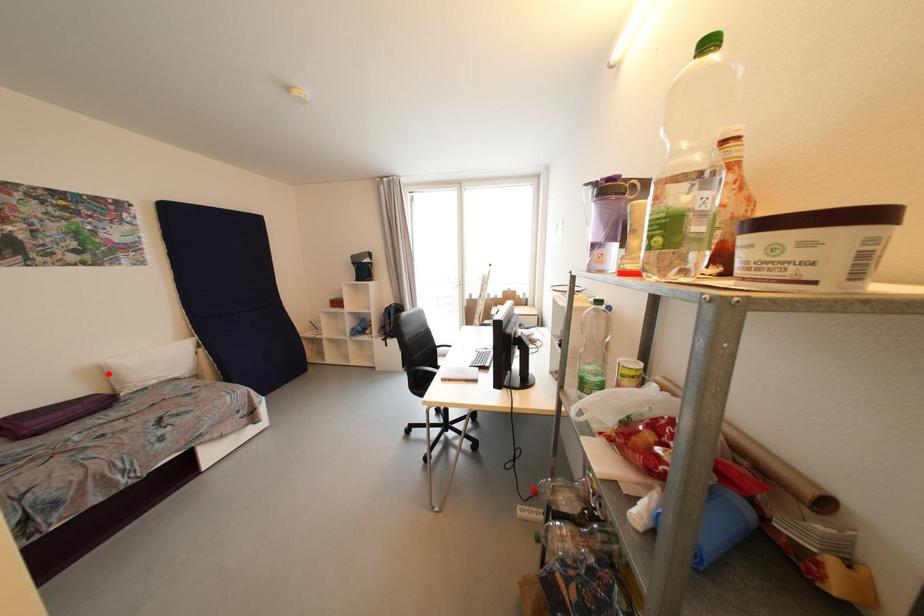
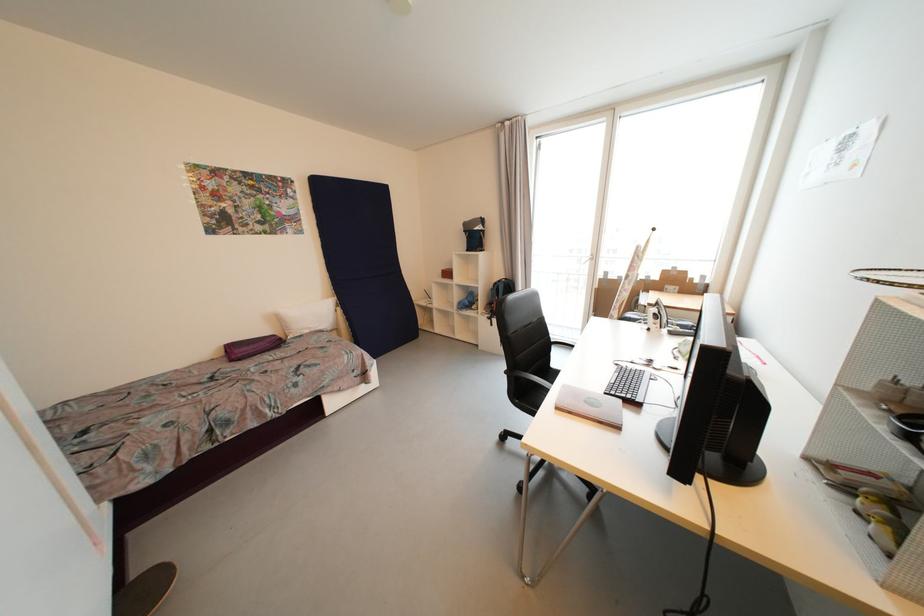
Question: I am providing you with two images of the same scene from different viewpoints. A red point is shown in image1. For the corresponding object point in image2, is it positioned nearer or farther from the camera?

Choices:
 (A) Nearer
 (B) Farther

Answer: (A)